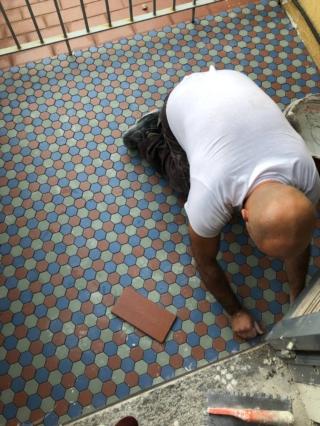
Find the location of `cement floor`. cement floor is located at coordinates (195, 402).